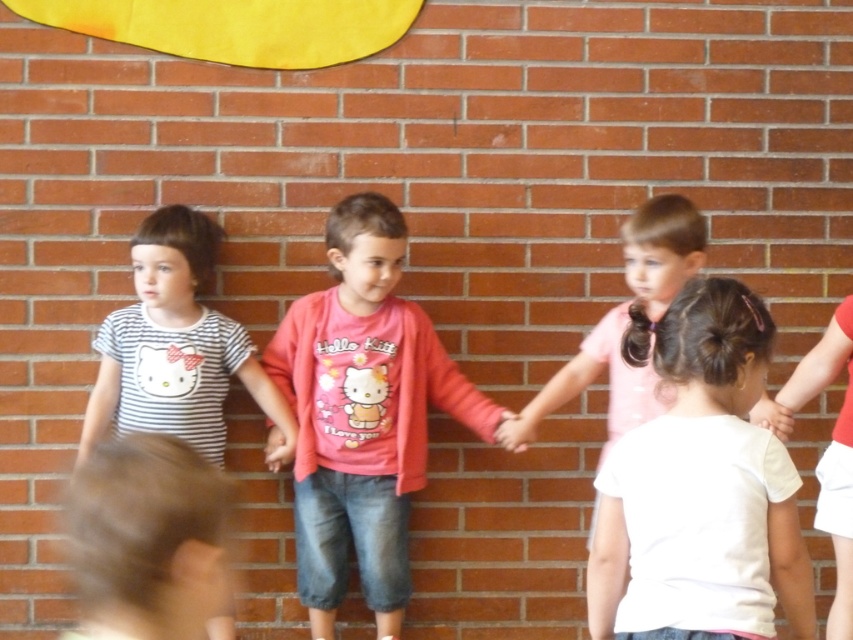
You are taking a photo of the scene and want to focus on both point (149, 252) and point (500, 420). Which point should you adjust your camera focus to first to ensure the closest object is in focus?

Point (149, 252) is closer to the camera than point (500, 420), so you should focus on point (149, 252) first to ensure the closest object is in focus.

You are a photographer trying to capture a clear shot of the white matte shirt at center and the smooth skin hand at center. Based on their sizes, which one should you focus on first to ensure it fits within the camera frame?

The white matte shirt at center might be wider than smooth skin hand at center, so you should focus on the white matte shirt at center first to ensure it fits within the camera frame.